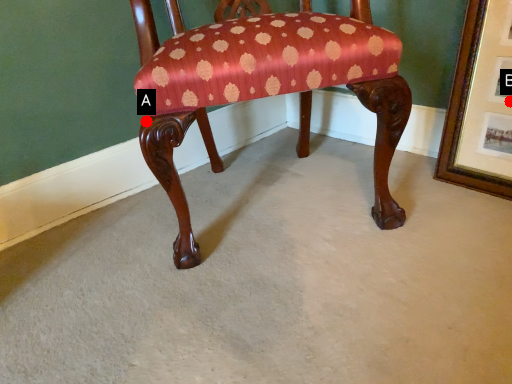
Question: Two points are circled on the image, labeled by A and B beside each circle. Which point is farther to the camera?

Choices:
 (A) A is further
 (B) B is further

Answer: (B)